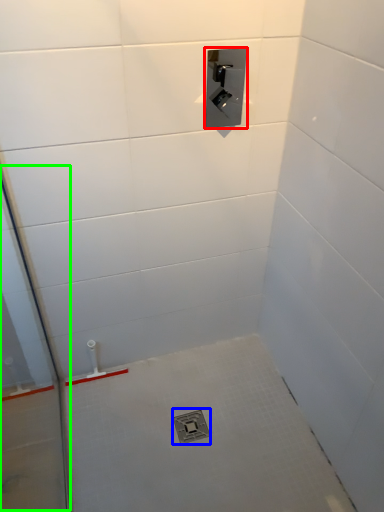
Question: Considering the real-world distances, which object is closest to plumbing fixture (highlighted by a red box)? drain (highlighted by a blue box) or glass door (highlighted by a green box).

Choices:
 (A) drain
 (B) glass door

Answer: (B)